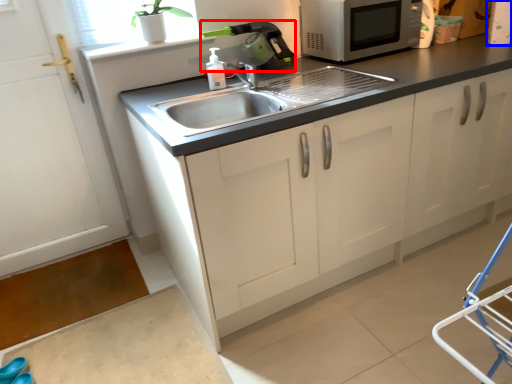
Question: Which object appears farthest to the camera in this image, appliance (highlighted by a red box) or appliance (highlighted by a blue box)?

Choices:
 (A) appliance
 (B) appliance

Answer: (B)